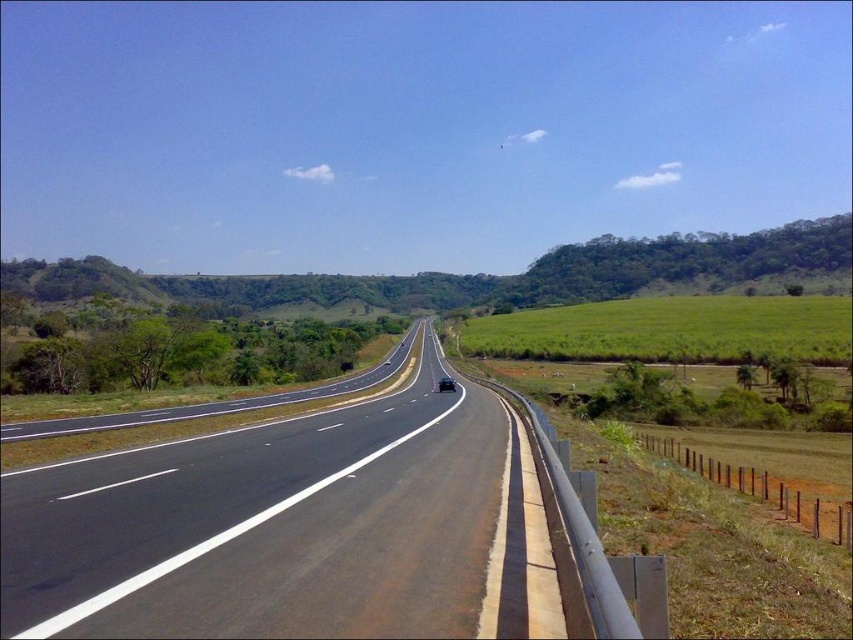
Question: Observing the image, what is the correct spatial positioning of black asphalt highway at center in reference to shiny black sedan at center?

Choices:
 (A) below
 (B) above

Answer: (B)

Question: Which of the following is the farthest from the observer?

Choices:
 (A) (358, 483)
 (B) (442, 380)

Answer: (B)

Question: Is black asphalt highway at center closer to the viewer compared to shiny black sedan at center?

Choices:
 (A) yes
 (B) no

Answer: (A)

Question: Can you confirm if black asphalt highway at center is thinner than shiny black sedan at center?

Choices:
 (A) no
 (B) yes

Answer: (A)